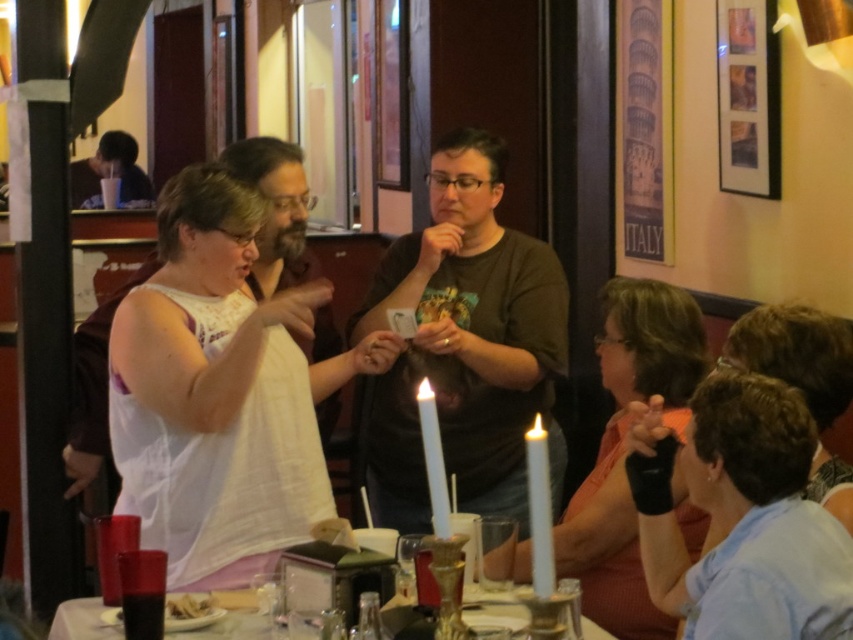
Can you confirm if white wax candle at center is shorter than dark brown bread at lower left?

No.

Does point (438, 452) come in front of point (213, 618)?

Yes, it is in front of point (213, 618).

This screenshot has width=853, height=640. Find the location of `white wax candle at center`. white wax candle at center is located at coordinates click(433, 460).

Is white fabric shirt at center behind orange fabric at lower right?

Yes, white fabric shirt at center is further from the viewer.

Does point (186, 348) come closer to viewer compared to point (625, 552)?

Yes, point (186, 348) is in front of point (625, 552).

Is point (235, 189) more distant than point (606, 440)?

That is False.

This screenshot has height=640, width=853. Identify the location of white fabric shirt at center. (213, 392).

Who is more distant from viewer, (170, 557) or (225, 618)?

Positioned behind is point (170, 557).

Can you confirm if white fabric shirt at center is wider than translucent glass table at center?

Indeed, white fabric shirt at center has a greater width compared to translucent glass table at center.

Between point (180, 237) and point (82, 632), which one is positioned behind?

The point (180, 237) is more distant.

Identify the location of white fabric shirt at center. (213, 392).